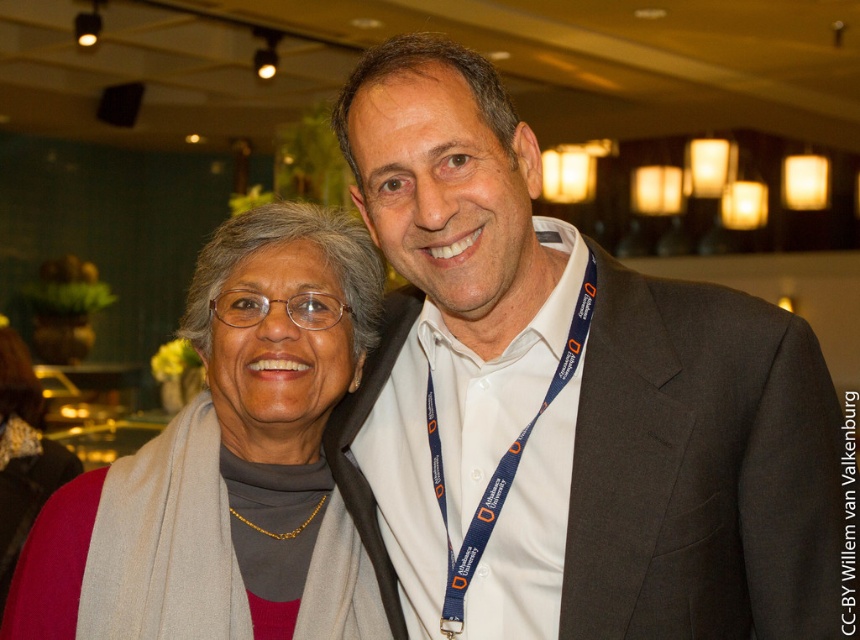
From the picture: You are a photographer standing at the camera position. You want to adjust the focus to capture the matte gray scarf at left clearly. Is the scarf within the standard camera focus range of 3 to 6 feet?

The matte gray scarf at left is 4.52 feet away from the camera, which falls within the standard camera focus range of 3 to 6 feet. Therefore, the scarf is within the focus range and can be captured clearly.

You are a photographer adjusting the lighting for a portrait. You notice the white shirt at center and the blue fabric lanyard at center in the frame. Which object should you focus on first if you want to ensure proper exposure for the taller one?

The white shirt at center is taller than the blue fabric lanyard at center, so you should focus on the white shirt at center first to ensure proper exposure for the taller object.

You are organizing a photo shoot and need to ensure that the white shirt at center and the matte gray scarf at left are visible in the frame. Based on their sizes, which object should you prioritize keeping in focus to ensure it doesn

The white shirt at center should be prioritized in focus because its width is larger than the matte gray scarf at left, making it more prominent in the frame.